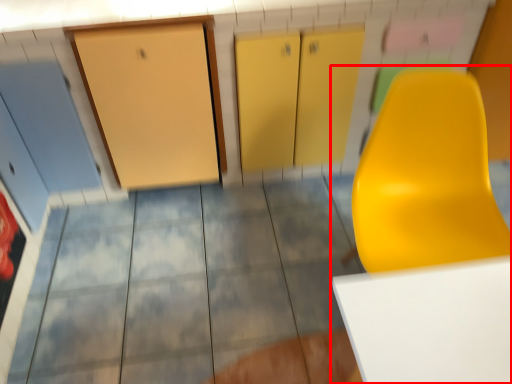
Question: Observing the image, what is the correct spatial positioning of furniture (annotated by the red box) in reference to tile?

Choices:
 (A) left
 (B) right

Answer: (B)